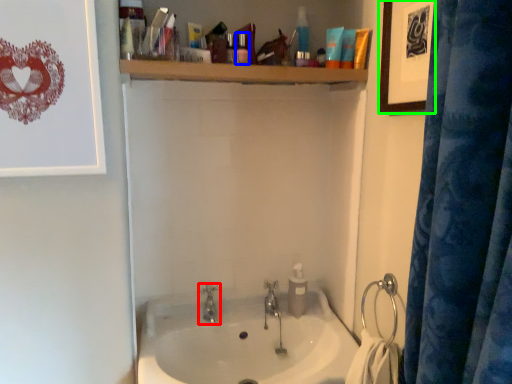
Question: Considering the real-world distances, which object is farthest from tap (highlighted by a red box)? toiletry (highlighted by a blue box) or picture frame (highlighted by a green box)?

Choices:
 (A) toiletry
 (B) picture frame

Answer: (B)